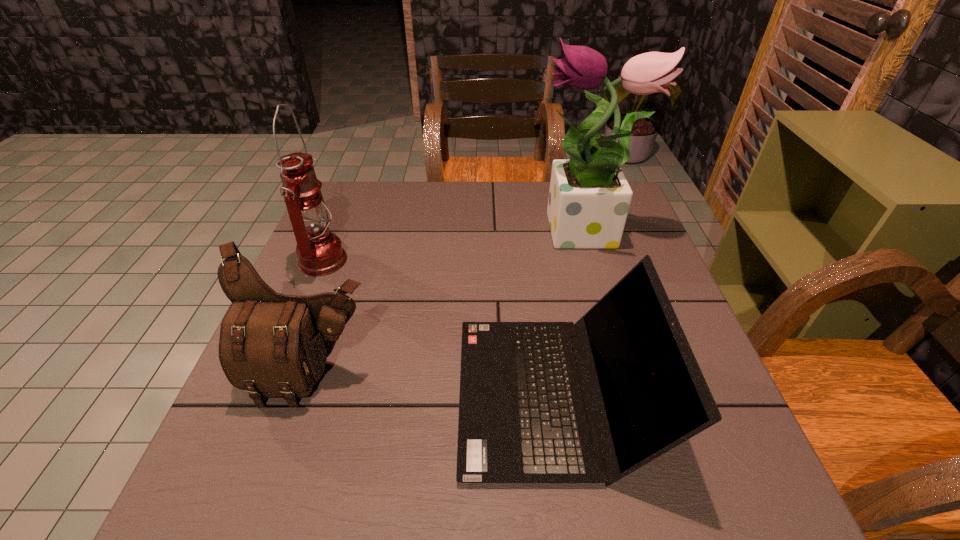
The image size is (960, 540). Identify the location of free spot located 0.370m on the screen of the laptop computer. (263, 395).

Locate an element on the screen. This screenshot has width=960, height=540. free space located on the screen of the laptop computer is located at coordinates [x=311, y=395].

This screenshot has height=540, width=960. Identify the location of object situated at the far edge. (589, 198).

This screenshot has height=540, width=960. Find the location of `object at the near edge`. object at the near edge is located at coordinates (524, 412).

Image resolution: width=960 pixels, height=540 pixels. I want to click on oil lamp located at the left edge, so click(319, 251).

The height and width of the screenshot is (540, 960). I want to click on shoulder bag at the left edge, so click(x=271, y=345).

Identify the location of flower arrangement that is at the right edge. Image resolution: width=960 pixels, height=540 pixels. (589, 198).

Where is `laptop computer located in the right edge section of the desktop`? laptop computer located in the right edge section of the desktop is located at coordinates (524, 412).

This screenshot has width=960, height=540. I want to click on object at the far right corner, so click(589, 198).

Where is `object situated at the near right corner`? The width and height of the screenshot is (960, 540). object situated at the near right corner is located at coordinates (524, 412).